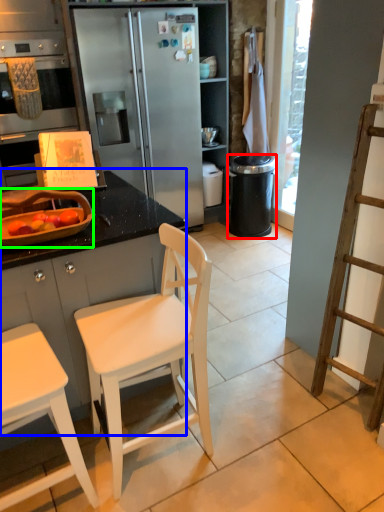
Question: Which is nearer to the trash bin/can (highlighted by a red box)? cabinetry (highlighted by a blue box) or appliance (highlighted by a green box).

Choices:
 (A) cabinetry
 (B) appliance

Answer: (A)